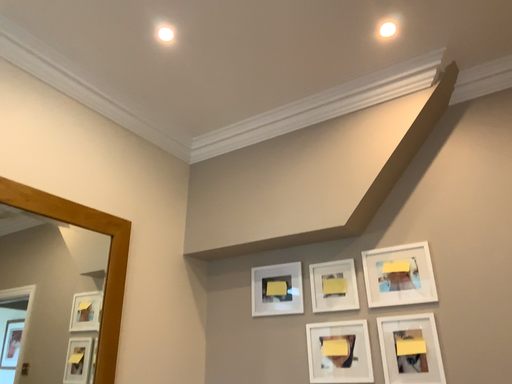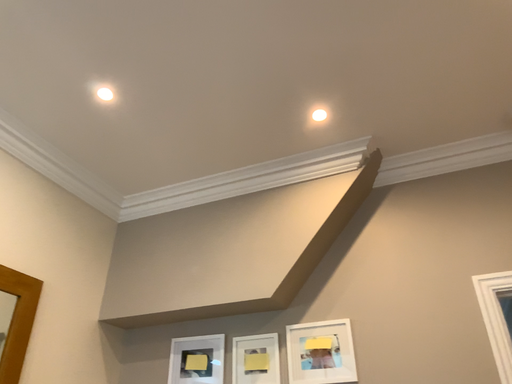
Question: Which way did the camera rotate in the video?

Choices:
 (A) rotated right
 (B) rotated left

Answer: (A)